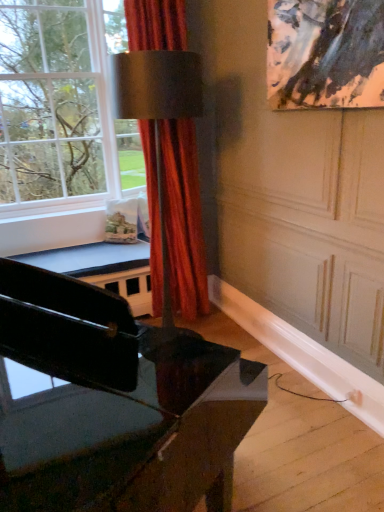
What do you see at coordinates (117, 404) in the screenshot? I see `black glossy piano at lower left` at bounding box center [117, 404].

This screenshot has height=512, width=384. What are the coordinates of `clear glass window at upper left` in the screenshot? It's located at (62, 102).

Locate an element on the screen. This screenshot has height=512, width=384. satin red curtain at center is located at coordinates (183, 218).

From the image's perspective, relative to satin red curtain at center, is black glossy piano at lower left above or below?

Clearly, from the image's perspective, black glossy piano at lower left is below satin red curtain at center.

Is point (119, 398) closer or farther from the camera than point (171, 253)?

Point (119, 398).

Considering the relative positions of black glossy piano at lower left and satin red curtain at center in the image provided, is black glossy piano at lower left to the right of satin red curtain at center from the viewer's perspective?

No, black glossy piano at lower left is not to the right of satin red curtain at center.

Consider the image. Can you confirm if black glossy piano at lower left is shorter than satin red curtain at center?

Indeed, black glossy piano at lower left has a lesser height compared to satin red curtain at center.

Is clear glass window at upper left bigger than black glossy piano at lower left?

Indeed, clear glass window at upper left has a larger size compared to black glossy piano at lower left.

Would you say clear glass window at upper left contains black glossy piano at lower left?

Actually, black glossy piano at lower left is outside clear glass window at upper left.

Does clear glass window at upper left have a lesser width compared to black glossy piano at lower left?

No.

Is satin red curtain at center wider or thinner than clear glass window at upper left?

In the image, satin red curtain at center appears to be more narrow than clear glass window at upper left.

Would you consider satin red curtain at center to be distant from clear glass window at upper left?

Actually, satin red curtain at center and clear glass window at upper left are a little close together.

Measure the distance between satin red curtain at center and clear glass window at upper left.

They are 39.05 inches apart.

From a real-world perspective, which is physically below, satin red curtain at center or clear glass window at upper left?

From a 3D spatial view, satin red curtain at center is below.

Between point (160, 284) and point (39, 472), which one is positioned behind?

The point (160, 284) is more distant.

Is satin red curtain at center situated inside black glossy piano at lower left or outside?

satin red curtain at center cannot be found inside black glossy piano at lower left.

Considering the relative sizes of satin red curtain at center and black glossy piano at lower left in the image provided, is satin red curtain at center wider than black glossy piano at lower left?

In fact, satin red curtain at center might be narrower than black glossy piano at lower left.

In terms of size, does satin red curtain at center appear bigger or smaller than black glossy piano at lower left?

satin red curtain at center is smaller than black glossy piano at lower left.

Between clear glass window at upper left and satin red curtain at center, which one is positioned in front?

clear glass window at upper left is closer to the camera.

Is clear glass window at upper left far away from satin red curtain at center?

No, clear glass window at upper left is not far away from satin red curtain at center.

Is black glossy piano at lower left bigger or smaller than clear glass window at upper left?

Clearly, black glossy piano at lower left is smaller in size than clear glass window at upper left.

Is black glossy piano at lower left inside the boundaries of clear glass window at upper left, or outside?

black glossy piano at lower left lies outside clear glass window at upper left.

Can you confirm if black glossy piano at lower left is shorter than clear glass window at upper left?

Correct, black glossy piano at lower left is not as tall as clear glass window at upper left.

In the image, there is a satin red curtain at center. Where is `piano below it (from a real-world perspective)`? This screenshot has width=384, height=512. piano below it (from a real-world perspective) is located at coordinates (117, 404).

Find the location of `piano in front of the clear glass window at upper left`. piano in front of the clear glass window at upper left is located at coordinates (117, 404).

When comparing their distances from black glossy piano at lower left, does satin red curtain at center or clear glass window at upper left seem closer?

The object closer to black glossy piano at lower left is satin red curtain at center.

Which object lies nearer to the anchor point black glossy piano at lower left, clear glass window at upper left or satin red curtain at center?

Among the two, satin red curtain at center is located nearer to black glossy piano at lower left.

Looking at the image, which one is located closer to clear glass window at upper left, black glossy piano at lower left or satin red curtain at center?

satin red curtain at center lies closer to clear glass window at upper left than the other object.

Looking at this image, estimate the real-world distances between objects in this image. Which object is closer to satin red curtain at center, black glossy piano at lower left or clear glass window at upper left?

clear glass window at upper left lies closer to satin red curtain at center than the other object.

When comparing their distances from clear glass window at upper left, does satin red curtain at center or black glossy piano at lower left seem closer?

satin red curtain at center is closer to clear glass window at upper left.

When comparing their distances from satin red curtain at center, does clear glass window at upper left or black glossy piano at lower left seem closer?

clear glass window at upper left is closer to satin red curtain at center.

The image size is (384, 512). What are the coordinates of `window between black glossy piano at lower left and satin red curtain at center in the front-back direction` in the screenshot? It's located at (62, 102).